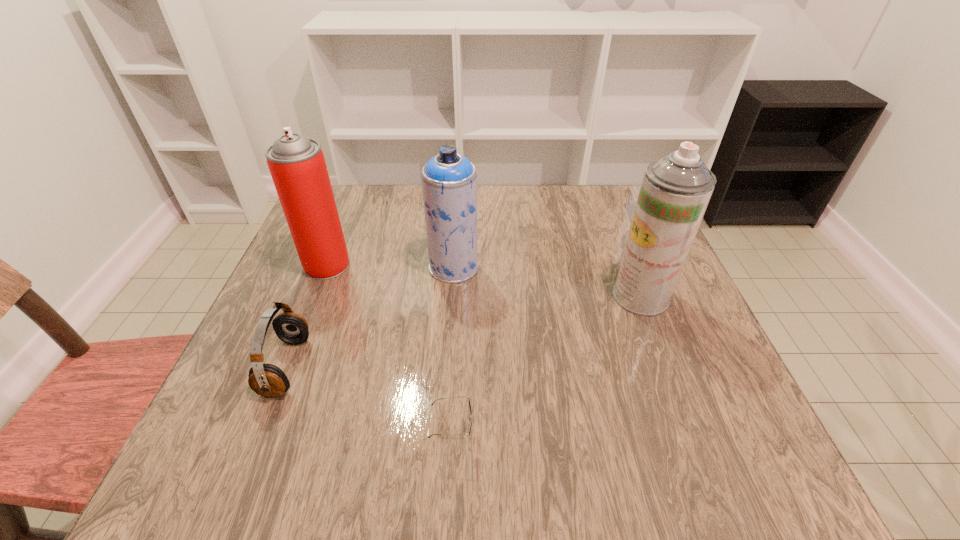
The width and height of the screenshot is (960, 540). I want to click on the third closest object relative to the headset, so click(449, 180).

Select which object appears as the closest to the leftmost aerosol can. Please provide its 2D coordinates. Your answer should be formatted as a tuple, i.e. [(x, y)], where the tuple contains the x and y coordinates of a point satisfying the conditions above.

[(267, 380)]

Identify which aerosol can is the closest to the leftmost aerosol can. Please provide its 2D coordinates. Your answer should be formatted as a tuple, i.e. [(x, y)], where the tuple contains the x and y coordinates of a point satisfying the conditions above.

[(449, 180)]

Locate an element on the screen. The height and width of the screenshot is (540, 960). aerosol can that can be found as the third closest to the fourth tallest object is located at coordinates (675, 191).

I want to click on blank space that satisfies the following two spatial constraints: 1. on the front side of the second aerosol can from left to right; 2. on the ear cups of the headset, so click(447, 367).

At what (x,y) coordinates should I click in order to perform the action: click on vacant area that satisfies the following two spatial constraints: 1. on the front side of the leftmost aerosol can; 2. on the left side of the rightmost object. Please return your answer as a coordinate pair (x, y). This screenshot has height=540, width=960. Looking at the image, I should click on (315, 296).